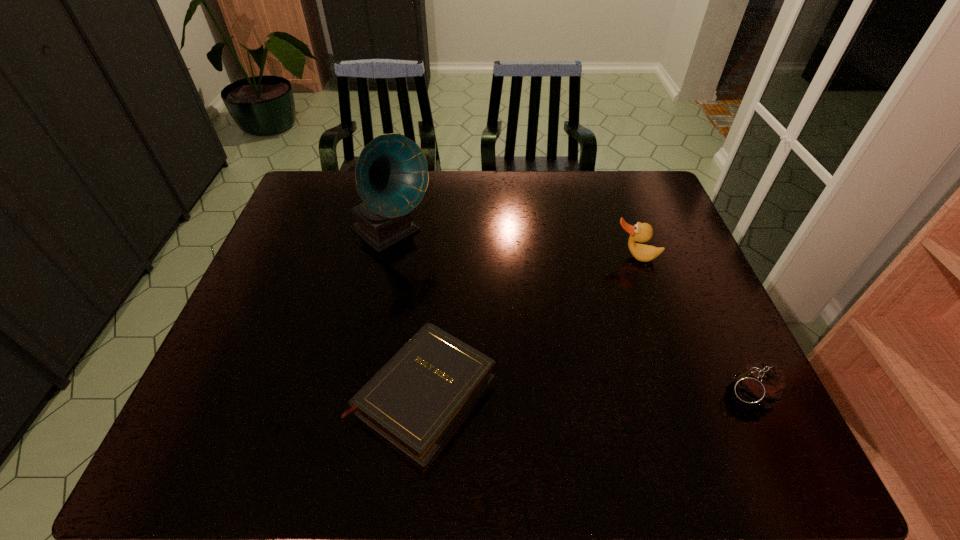
Where is `the shortest object`? The width and height of the screenshot is (960, 540). the shortest object is located at coordinates (416, 400).

At what (x,y) coordinates should I click in order to perform the action: click on the second shortest object. Please return your answer as a coordinate pair (x, y). This screenshot has height=540, width=960. Looking at the image, I should click on (762, 385).

I want to click on pinecone, so click(x=762, y=385).

At what (x,y) coordinates should I click in order to perform the action: click on the tallest object. Please return your answer as a coordinate pair (x, y). This screenshot has width=960, height=540. Looking at the image, I should click on (391, 174).

Find the location of a particular element. This screenshot has height=540, width=960. duck is located at coordinates (641, 232).

Locate an element on the screen. Image resolution: width=960 pixels, height=540 pixels. free spot located on the right of the shortest object is located at coordinates (537, 394).

In order to click on vacant space located with a leaf charm attached to the pinecone in this screenshot , I will do `click(631, 393)`.

Find the location of a particular element. This screenshot has width=960, height=540. vacant space situated with a leaf charm attached to the pinecone is located at coordinates (552, 393).

Find the location of a particular element. free space located 0.240m with a leaf charm attached to the pinecone is located at coordinates (612, 393).

You are a GUI agent. You are given a task and a screenshot of the screen. Output one action in this format:
    pyautogui.click(x=<x>, y=<y>)
    Task: Click on the free spot located from the horn of the phonograph_record
    The height and width of the screenshot is (540, 960).
    Given the screenshot: What is the action you would take?
    pyautogui.click(x=442, y=275)